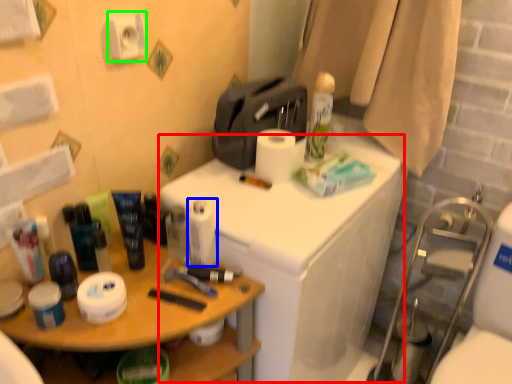
Question: Based on their relative distances, which object is farther from counter (highlighted by a red box)? Choose from toilet paper (highlighted by a blue box) and toilet paper (highlighted by a green box).

Choices:
 (A) toilet paper
 (B) toilet paper

Answer: (B)